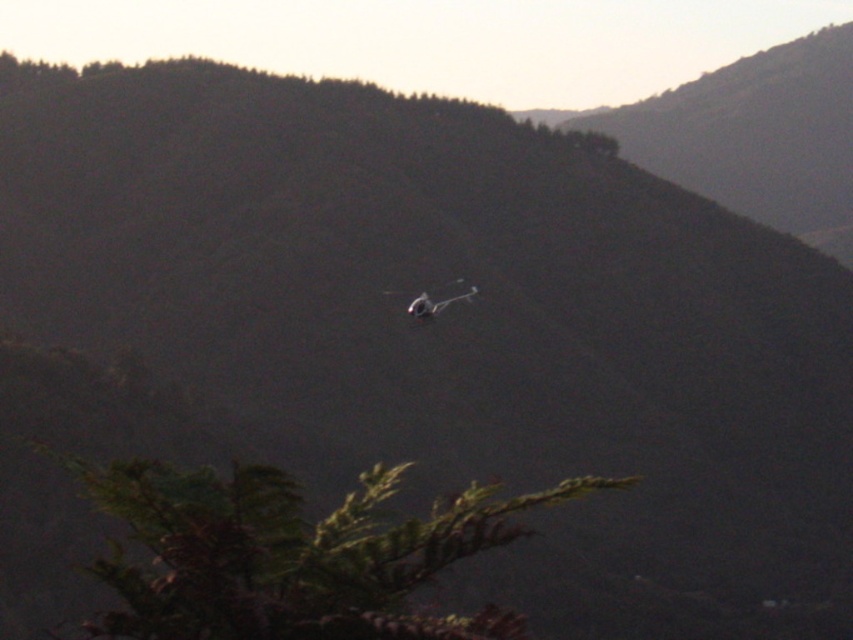
Can you confirm if green leafy tree at lower center is shorter than metallic gray plane at center?

Yes, green leafy tree at lower center is shorter than metallic gray plane at center.

Is green leafy tree at lower center smaller than metallic gray plane at center?

Yes.

The image size is (853, 640). What do you see at coordinates (292, 554) in the screenshot?
I see `green leafy tree at lower center` at bounding box center [292, 554].

At what (x,y) coordinates should I click in order to perform the action: click on green leafy tree at lower center. Please return your answer as a coordinate pair (x, y). Looking at the image, I should click on [292, 554].